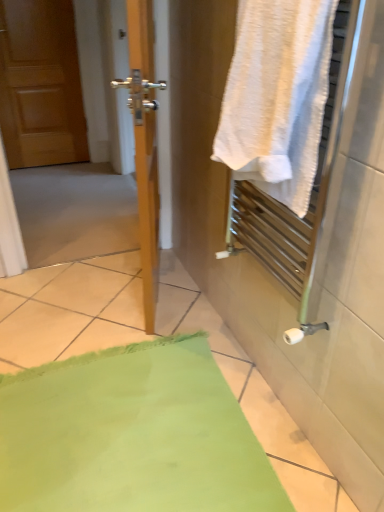
Question: From a real-world perspective, is wooden screen door at left under green fabric bath mat at lower left?

Choices:
 (A) no
 (B) yes

Answer: (A)

Question: Can you confirm if wooden screen door at left is taller than green fabric bath mat at lower left?

Choices:
 (A) no
 (B) yes

Answer: (B)

Question: From the image's perspective, would you say wooden screen door at left is positioned over green fabric bath mat at lower left?

Choices:
 (A) yes
 (B) no

Answer: (A)

Question: Is wooden screen door at left placed right next to green fabric bath mat at lower left?

Choices:
 (A) yes
 (B) no

Answer: (B)

Question: Can we say wooden screen door at left lies outside green fabric bath mat at lower left?

Choices:
 (A) yes
 (B) no

Answer: (A)

Question: In the image, is wooden screen door at left positioned in front of or behind green fabric bath mat at lower left?

Choices:
 (A) behind
 (B) front

Answer: (A)

Question: Is wooden screen door at left inside the boundaries of green fabric bath mat at lower left, or outside?

Choices:
 (A) outside
 (B) inside

Answer: (A)

Question: From a real-world perspective, is wooden screen door at left above or below green fabric bath mat at lower left?

Choices:
 (A) above
 (B) below

Answer: (A)

Question: Is wooden screen door at left taller or shorter than green fabric bath mat at lower left?

Choices:
 (A) short
 (B) tall

Answer: (B)

Question: Relative to wooden screen door at left, is green fabric bath mat at lower left in front or behind?

Choices:
 (A) front
 (B) behind

Answer: (A)

Question: Considering the positions of green fabric bath mat at lower left and wooden screen door at left in the image, is green fabric bath mat at lower left bigger or smaller than wooden screen door at left?

Choices:
 (A) big
 (B) small

Answer: (B)

Question: Considering the positions of point (119, 376) and point (155, 204), is point (119, 376) closer or farther from the camera than point (155, 204)?

Choices:
 (A) farther
 (B) closer

Answer: (B)

Question: Is green fabric bath mat at lower left taller or shorter than wooden screen door at left?

Choices:
 (A) short
 (B) tall

Answer: (A)

Question: From a real-world perspective, is green fabric bath mat at lower left positioned above or below white textured towel at right?

Choices:
 (A) above
 (B) below

Answer: (B)

Question: From the image's perspective, relative to white textured towel at right, is green fabric bath mat at lower left above or below?

Choices:
 (A) below
 (B) above

Answer: (A)